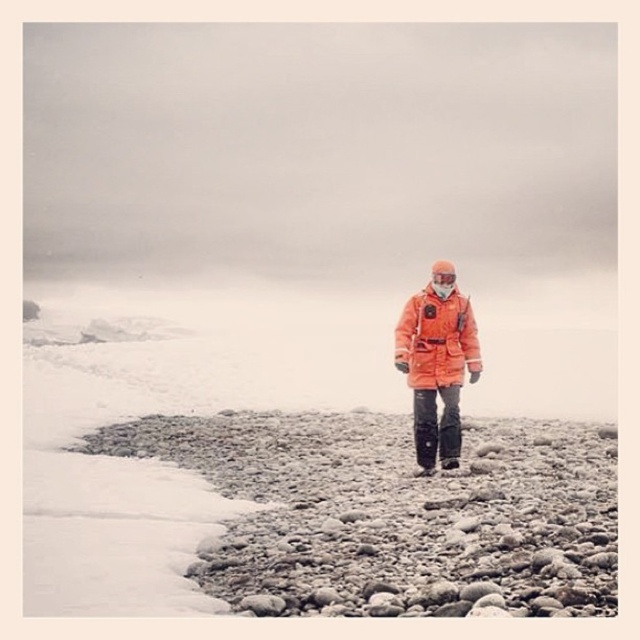
Question: Is white matte snow at center wider than orange matte jacket at center?

Choices:
 (A) yes
 (B) no

Answer: (A)

Question: Which object appears closest to the camera in this image?

Choices:
 (A) white matte snow at center
 (B) orange matte jacket at center

Answer: (A)

Question: Is white matte snow at center to the left of orange matte jacket at center from the viewer's perspective?

Choices:
 (A) yes
 (B) no

Answer: (A)

Question: Does white matte snow at center appear on the left side of orange matte jacket at center?

Choices:
 (A) no
 (B) yes

Answer: (B)